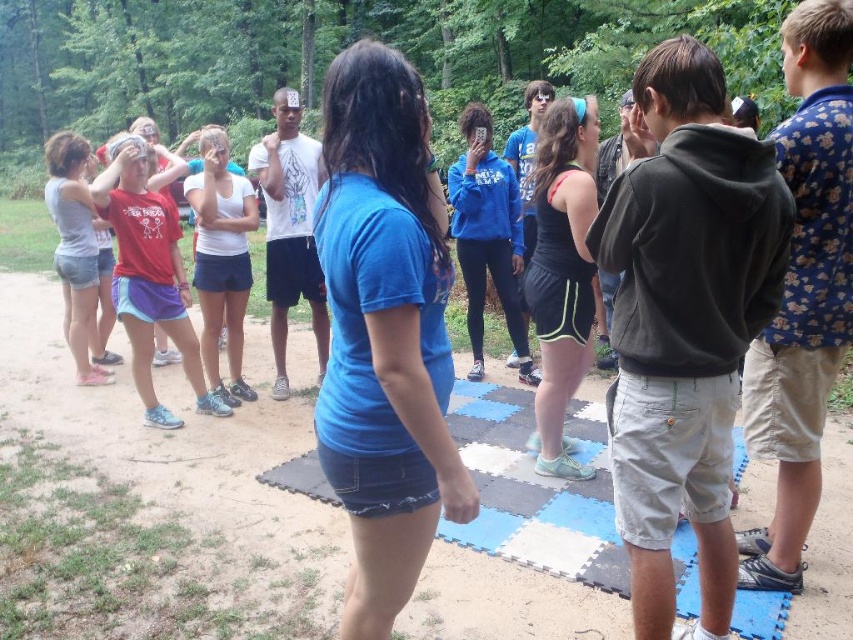
Who is taller, black matte tank top at center or matte red t-shirt at left?

matte red t-shirt at left is taller.

Is black matte tank top at center wider than matte red t-shirt at left?

In fact, black matte tank top at center might be narrower than matte red t-shirt at left.

Measure the distance between black matte tank top at center and camera.

black matte tank top at center is 3.17 meters away from camera.

At what (x,y) coordinates should I click in order to perform the action: click on black matte tank top at center. Please return your answer as a coordinate pair (x, y). The image size is (853, 640). Looking at the image, I should click on (561, 273).

Is point (712, 579) less distant than point (547, 141)?

Yes, point (712, 579) is in front of point (547, 141).

Who is shorter, dark gray hoodie at center-right or black matte tank top at center?

With less height is dark gray hoodie at center-right.

Between point (625, 300) and point (554, 132), which one is positioned behind?

The point (554, 132) is behind.

Where is `dark gray hoodie at center-right`? The height and width of the screenshot is (640, 853). dark gray hoodie at center-right is located at coordinates (683, 323).

Is point (451, 413) positioned after point (219, 244)?

No, (451, 413) is in front of (219, 244).

Which is behind, point (604, 516) or point (235, 198)?

The point (235, 198) is more distant.

What do you see at coordinates (535, 490) in the screenshot? This screenshot has height=640, width=853. I see `blue rubber yoga mat at center` at bounding box center [535, 490].

Locate an element on the screen. blue rubber yoga mat at center is located at coordinates (535, 490).